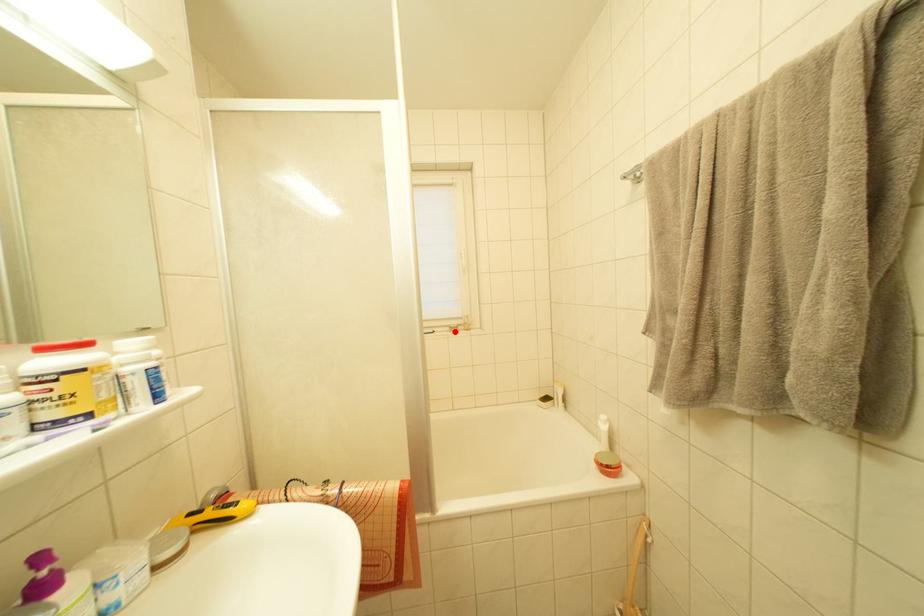
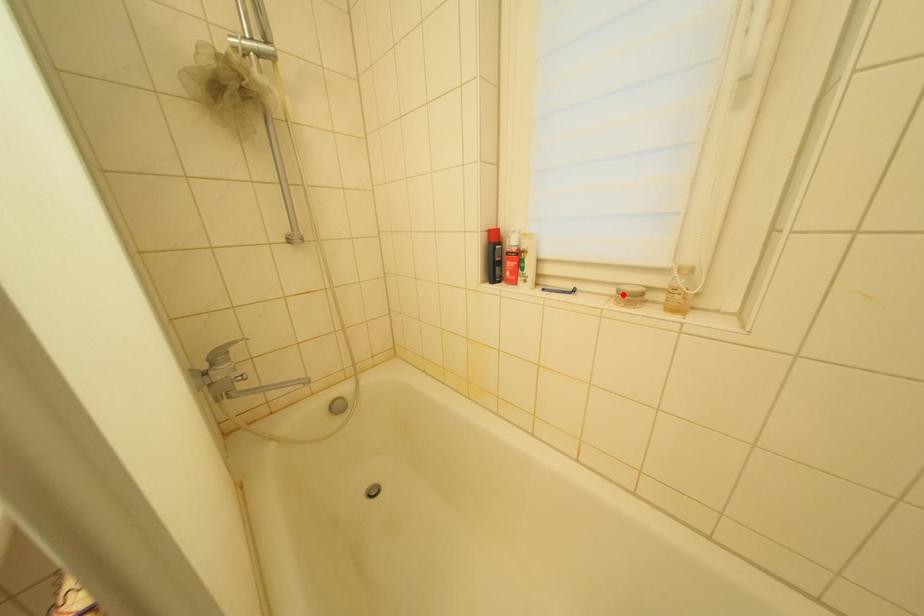
I am providing you with two images of the same scene from different viewpoints. A red point is marked on the first image and another point is marked on the second image. Is the red point in image1 aligned with the point shown in image2?

Yes